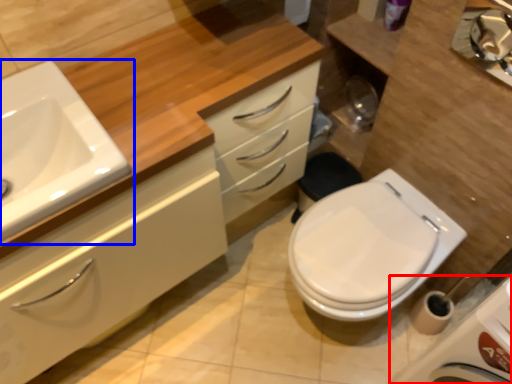
Question: Which object appears closest to the camera in this image, porcelain (highlighted by a red box) or sink (highlighted by a blue box)?

Choices:
 (A) porcelain
 (B) sink

Answer: (A)